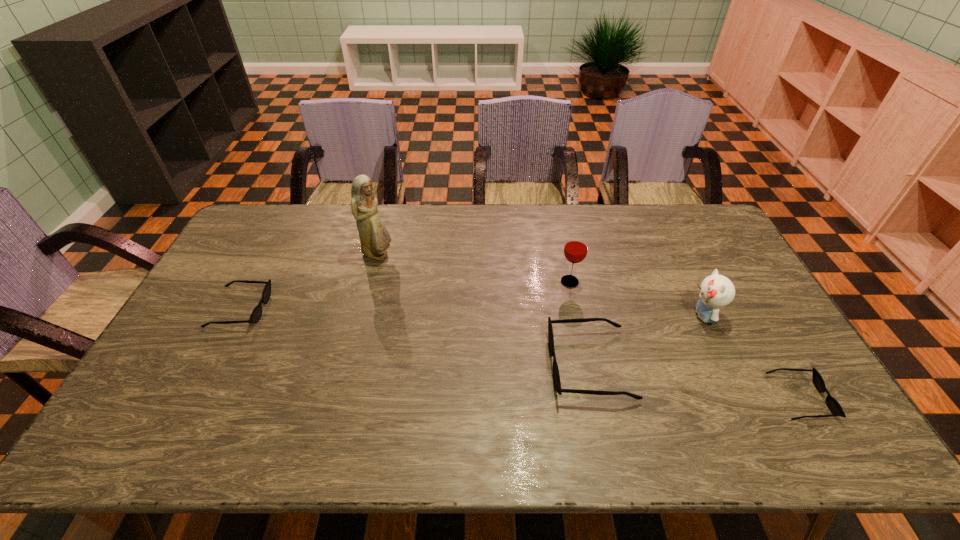
Identify the location of the fifth object from right to left. (374, 237).

Image resolution: width=960 pixels, height=540 pixels. I want to click on vacant space situated on the front-facing side of the second tallest sunglasses, so [322, 309].

The height and width of the screenshot is (540, 960). What are the coordinates of `vacant space situated 0.170m on the front-facing side of the second sunglasses from right to left` in the screenshot? It's located at (488, 364).

Locate an element on the screen. Image resolution: width=960 pixels, height=540 pixels. free location located 0.070m on the front-facing side of the second sunglasses from right to left is located at coordinates (525, 364).

Locate an element on the screen. This screenshot has height=540, width=960. vacant point located 0.260m on the front-facing side of the second sunglasses from right to left is located at coordinates (454, 364).

Find the location of a particular element. This screenshot has height=540, width=960. free location located 0.190m on the front-facing side of the kitten is located at coordinates (624, 315).

Where is `free space located 0.180m on the front-facing side of the kitten`? This screenshot has width=960, height=540. free space located 0.180m on the front-facing side of the kitten is located at coordinates (627, 315).

Locate an element on the screen. blank area located 0.160m on the front-facing side of the kitten is located at coordinates (635, 315).

Where is `free space located 0.210m on the back of the glass`? free space located 0.210m on the back of the glass is located at coordinates (560, 234).

Identify the location of vacant region located 0.300m on the front-facing side of the second object from left to right. (482, 255).